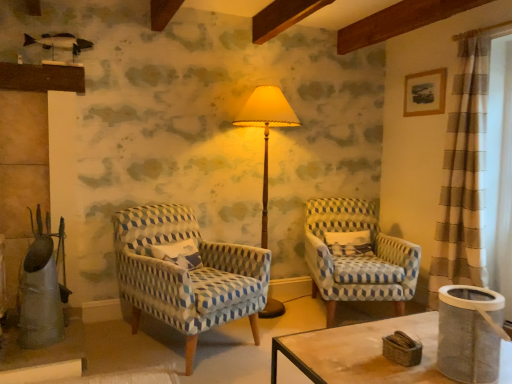
Question: Is white textured pillow at center further to camera compared to matte yellow fabric lampshade at center?

Choices:
 (A) no
 (B) yes

Answer: (B)

Question: Is white textured pillow at center in contact with matte yellow fabric lampshade at center?

Choices:
 (A) no
 (B) yes

Answer: (A)

Question: From the image's perspective, is white textured pillow at center on matte yellow fabric lampshade at center?

Choices:
 (A) no
 (B) yes

Answer: (A)

Question: From a real-world perspective, is white textured pillow at center physically above matte yellow fabric lampshade at center?

Choices:
 (A) yes
 (B) no

Answer: (B)

Question: Does white textured pillow at center turn towards matte yellow fabric lampshade at center?

Choices:
 (A) no
 (B) yes

Answer: (A)

Question: From the image's perspective, is white mesh screen at right positioned above or below blue patterned fabric chair at center, which is the second chair in right-to-left order?

Choices:
 (A) above
 (B) below

Answer: (A)

Question: Considering their positions, is white mesh screen at right located in front of or behind blue patterned fabric chair at center, marked as the 1th chair in a left-to-right arrangement?

Choices:
 (A) front
 (B) behind

Answer: (B)

Question: Based on their positions, is white mesh screen at right located to the left or right of blue patterned fabric chair at center, which is the second chair in right-to-left order?

Choices:
 (A) left
 (B) right

Answer: (B)

Question: Is white mesh screen at right wider or thinner than blue patterned fabric chair at center, marked as the 1th chair in a left-to-right arrangement?

Choices:
 (A) wide
 (B) thin

Answer: (B)

Question: Considering the positions of blue patterned fabric chair at center, the 1th chair in the right-to-left sequence, and white mesh screen at right in the image, is blue patterned fabric chair at center, the 1th chair in the right-to-left sequence, wider or thinner than white mesh screen at right?

Choices:
 (A) thin
 (B) wide

Answer: (B)

Question: From the image's perspective, is blue patterned fabric chair at center, the 1th chair in the right-to-left sequence, above or below white mesh screen at right?

Choices:
 (A) below
 (B) above

Answer: (A)

Question: Based on their sizes in the image, would you say blue patterned fabric chair at center, the 1th chair in the right-to-left sequence, is bigger or smaller than white mesh screen at right?

Choices:
 (A) big
 (B) small

Answer: (A)

Question: Considering the positions of blue patterned fabric chair at center, the 1th chair in the right-to-left sequence, and white mesh screen at right in the image, is blue patterned fabric chair at center, the 1th chair in the right-to-left sequence, taller or shorter than white mesh screen at right?

Choices:
 (A) short
 (B) tall

Answer: (A)

Question: Considering their positions, is blue patterned fabric chair at center, marked as the 1th chair in a left-to-right arrangement, located in front of or behind white mesh screen at right?

Choices:
 (A) front
 (B) behind

Answer: (A)

Question: Would you say blue patterned fabric chair at center, which is the second chair in right-to-left order, is inside or outside white mesh screen at right?

Choices:
 (A) outside
 (B) inside

Answer: (A)